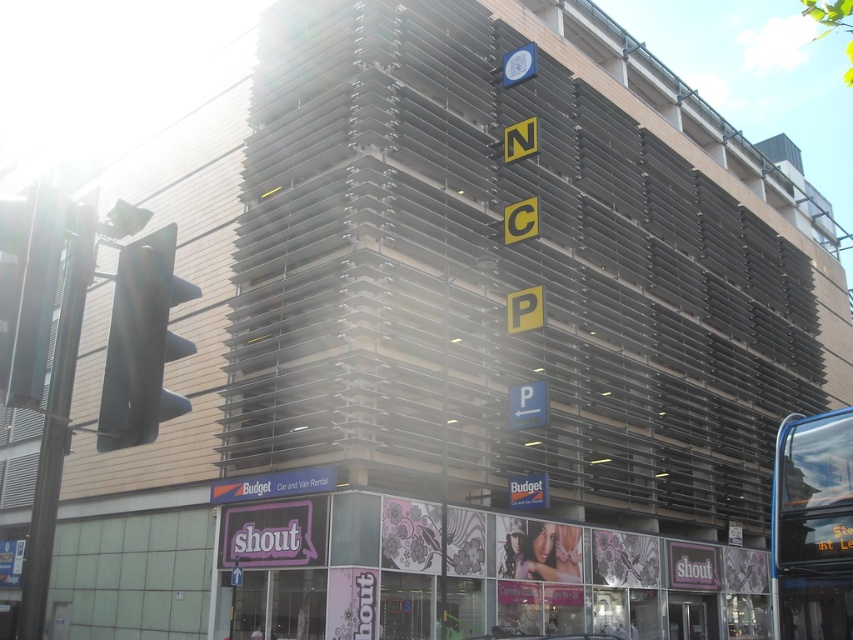
You are a delivery driver who needs to park your truck in the parking structure. Your truck is 2.5 meters wide. The parking structure has a width restriction of 2.4 meters. Can you determine if your truck can fit between the transparent glass bus at lower right and the black plastic traffic light at left?

The transparent glass bus at lower right is wider than the black plastic traffic light at left. Since the parking structure has a width restriction of 2.4 meters and your truck is 2.5 meters wide, your truck is already wider than the allowed limit. Therefore, it cannot fit regardless of the objects mentioned.

You are standing at the entrance of the NCP parking structure and want to take a photo of the parking structure. The camera you are using has a maximum focus range of 20 meters. Will the point at coordinates point (849,616) be in focus?

The point at coordinates point (849,616) is 22.18 meters from the camera, which exceeds the camera maximum focus range of 20 meters. Therefore, the point will not be in focus.